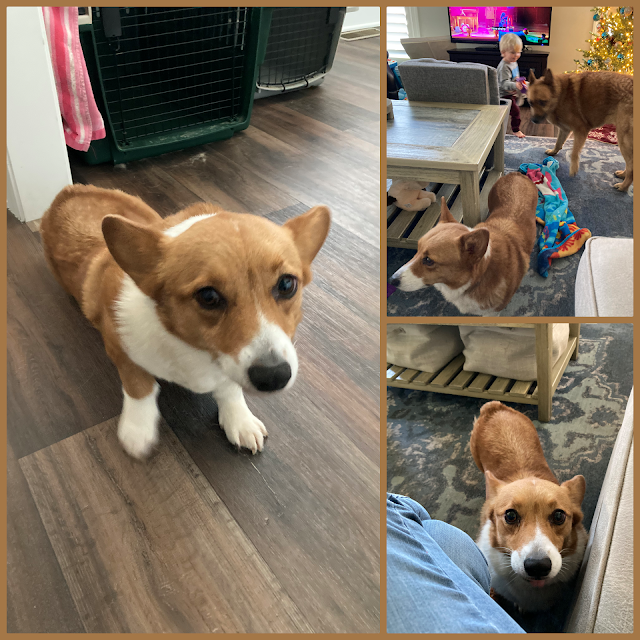
Identify the location of indoor pet kennel. pyautogui.click(x=166, y=90), pyautogui.click(x=300, y=36).